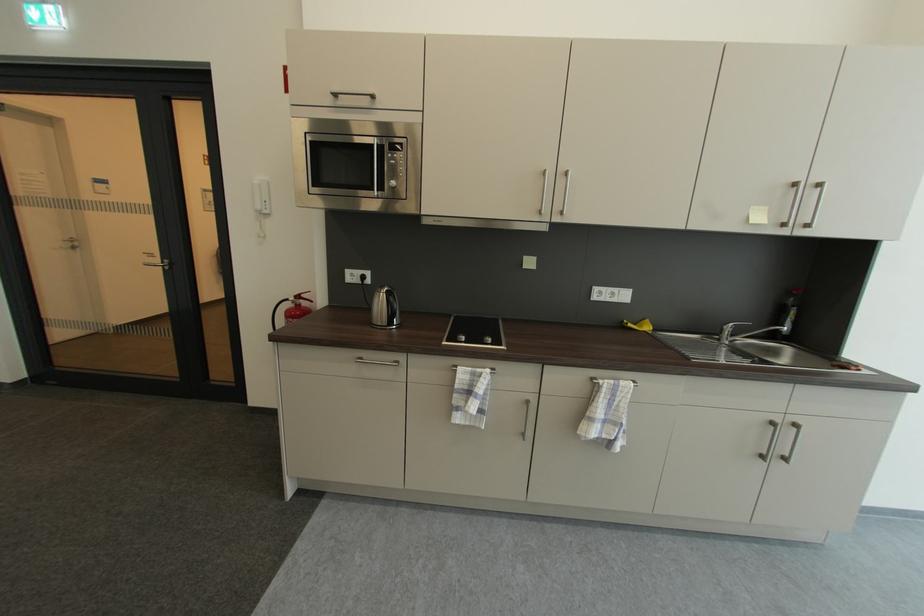
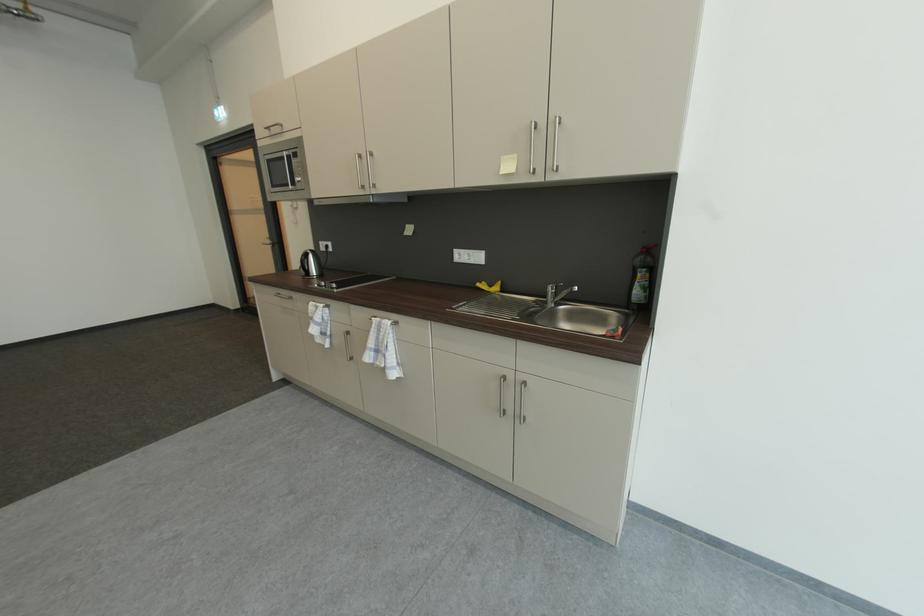
Find the pixel in the second image that matches (397,301) in the first image.

(310, 259)